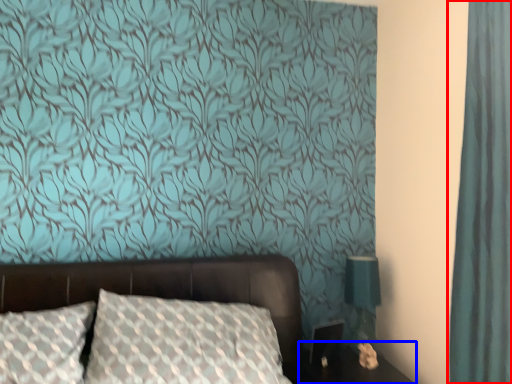
Question: Which object appears farthest to the camera in this image, curtain (highlighted by a red box) or table (highlighted by a blue box)?

Choices:
 (A) curtain
 (B) table

Answer: (B)